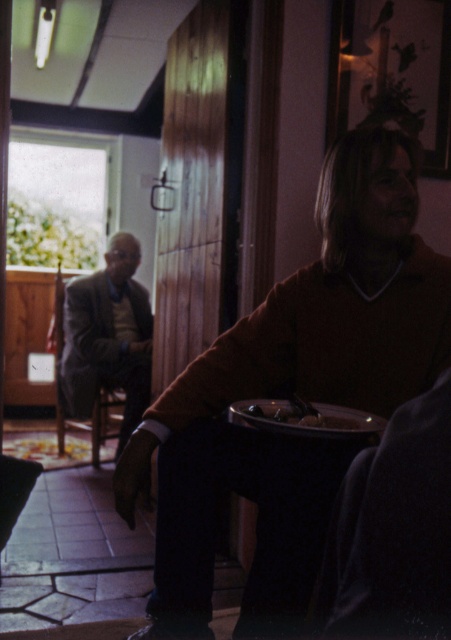
You are standing in the room and want to touch the point located at coordinates point (107, 337). Which object in the room is this point located on?

The point (107, 337) is located on the light brown woolen suit at left.

You are a photographer setting up a shoot in this room. You have a light brown woolen suit at left and a shiny metallic bowl at center. Which object should you move if you want to create more space between them?

You should move the light brown woolen suit at left since it is larger in size than the shiny metallic bowl at center, making it easier to reposition for spacing.

You are a photographer setting up a shot in this room. You need to place a new object between the matte brown sweater at center and the metallic silver tray at lower center. Based on their sizes, which object should be placed closer to the edge to ensure stability?

The metallic silver tray at lower center is narrower than the matte brown sweater at center, so placing it closer to the edge would be more stable since it has a smaller footprint.